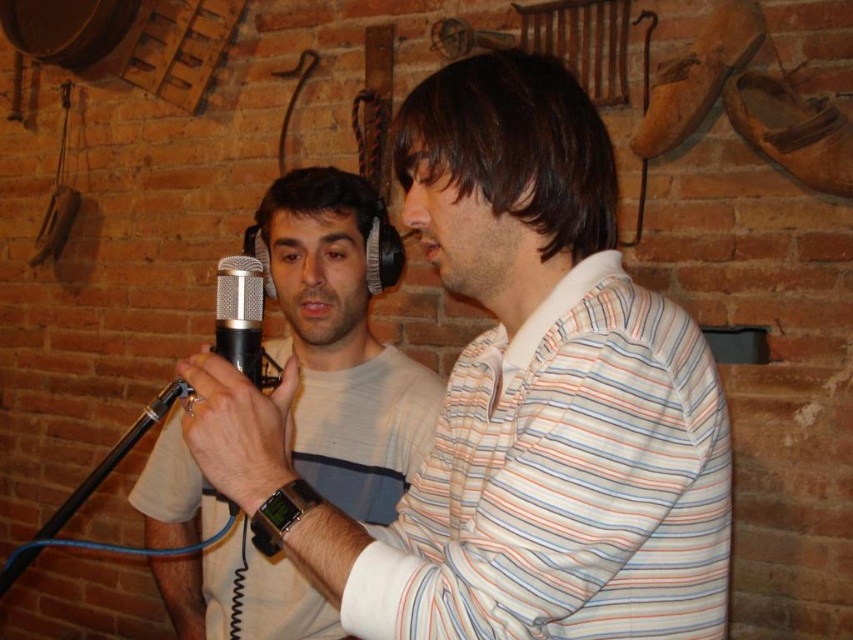
You are a sound engineer in a studio. You need to adjust the distance between the white striped shirt at center and the silver metallic microphone at center to ensure optimal sound quality. The recommended distance is between 8 to 12 inches. Is the current distance within the recommended range?

The white striped shirt at center is 10.61 inches from the silver metallic microphone at center, which falls within the recommended 8 to 12 inches range for optimal sound quality.

From the picture: You are standing in the studio and want to reach the point marked at coordinates point [572,422]. If your arm can extend 28 inches, can you reach it without moving?

The point [572,422] is 27.47 inches from the viewer, so yes, your arm can reach it since it extends 28 inches, which is longer than the distance.

You are designing a display case for a music store that needs to accommodate both a mannequin wearing the white striped shirt at center and the silver metallic microphone at center. Since the case has a width limit of 30 cm, and the shirt is wider than the microphone, will both items fit side by side if placed next to each other?

The white striped shirt at center is wider than the silver metallic microphone at center. If the total width of both items combined exceeds 30 cm, they might not fit. However, since the shirt is only slightly wider and the microphone is narrower, it depends on their exact dimensions. Without specific measurements, it is uncertain if they will fit within the 30 cm width limit.